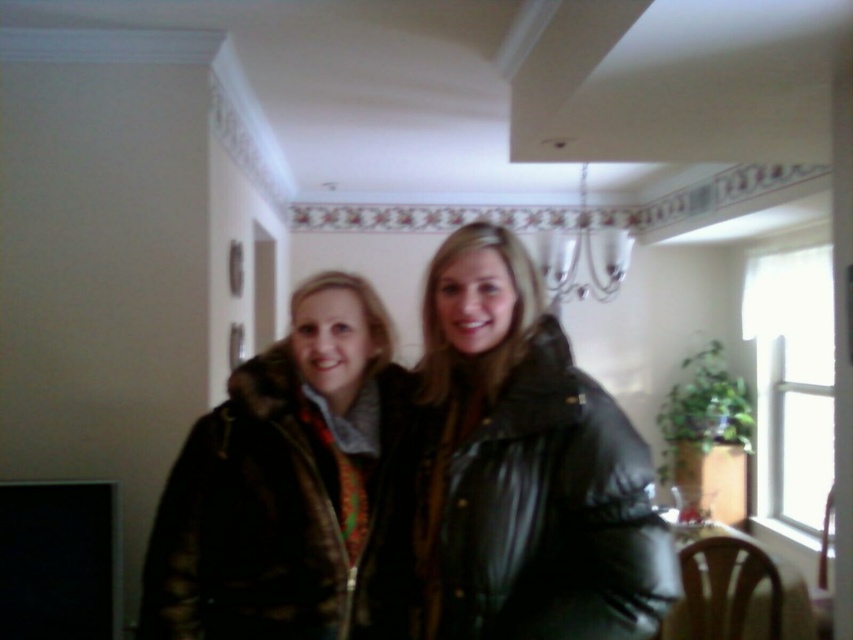
Question: Which of the following is the farthest from the observer?

Choices:
 (A) (325, 609)
 (B) (428, 611)

Answer: (B)

Question: Does shiny black jacket at center appear under fur-lined coat at center?

Choices:
 (A) no
 (B) yes

Answer: (A)

Question: Is shiny black jacket at center positioned at the back of fur-lined coat at center?

Choices:
 (A) no
 (B) yes

Answer: (A)

Question: Which point is farther from the camera taking this photo?

Choices:
 (A) (260, 545)
 (B) (468, 451)

Answer: (A)

Question: Is shiny black jacket at center thinner than fur-lined coat at center?

Choices:
 (A) yes
 (B) no

Answer: (B)